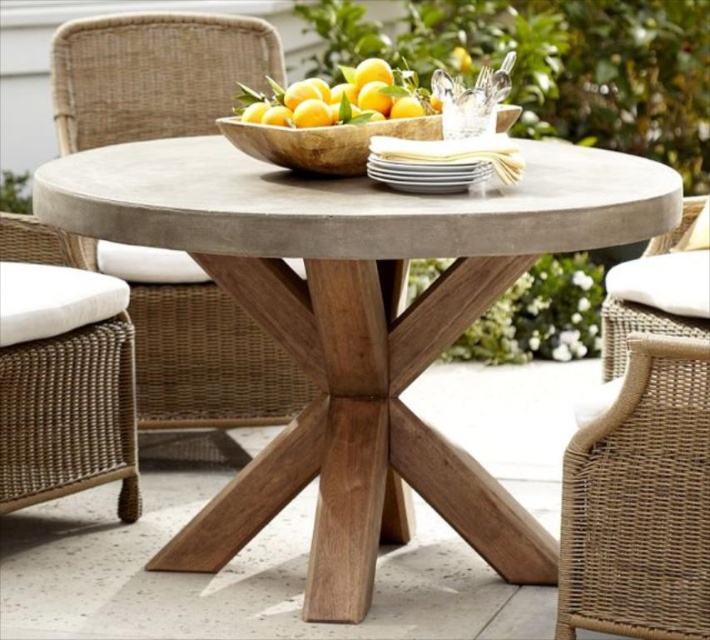
Question: Based on their relative distances, which object is farther from the woven rattan chair with white cushion at lower left?

Choices:
 (A) woven rattan chair at center
 (B) yellow matte/orange textured bowl at upper center
 (C) matte concrete table at center

Answer: (A)

Question: Can you confirm if matte concrete table at center is positioned below woven rattan chair at center?

Choices:
 (A) no
 (B) yes

Answer: (B)

Question: Is matte concrete table at center positioned in front of woven rattan chair at center?

Choices:
 (A) no
 (B) yes

Answer: (B)

Question: Is woven rattan chair with white cushion at lower left wider than yellow matte/orange textured bowl at upper center?

Choices:
 (A) no
 (B) yes

Answer: (A)

Question: Which object is farther from the camera taking this photo?

Choices:
 (A) matte concrete table at center
 (B) woven rattan chair with white cushion at lower left

Answer: (B)

Question: Which point is farther from the camera taking this photo?

Choices:
 (A) (207, 364)
 (B) (300, 86)

Answer: (A)